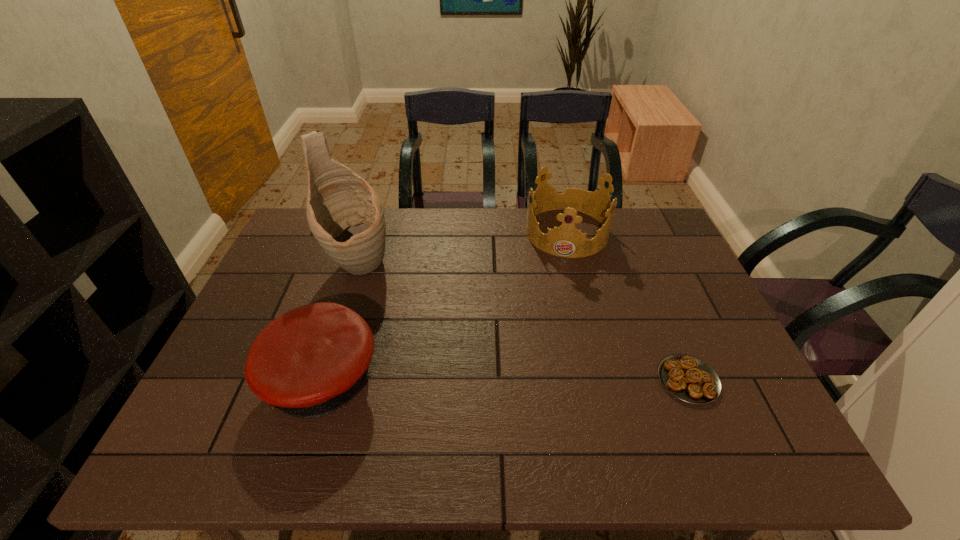
Identify the location of the second shortest object. This screenshot has width=960, height=540. (309, 362).

You are a GUI agent. You are given a task and a screenshot of the screen. Output one action in this format:
    pyautogui.click(x=<x>, y=<y>)
    Task: Click on the shortest object
    Image resolution: width=960 pixels, height=540 pixels.
    Given the screenshot: What is the action you would take?
    pyautogui.click(x=688, y=378)

What are the coordinates of `pitcher` in the screenshot? It's located at (346, 216).

I want to click on tiara, so click(567, 241).

The image size is (960, 540). I want to click on free space located 0.130m at the front of the cap where the visor is located, so click(x=209, y=380).

The image size is (960, 540). I want to click on free space located at the front of the cap where the visor is located, so click(x=235, y=380).

What are the coordinates of `vacant space located at the front of the cap where the visor is located` in the screenshot? It's located at (218, 380).

Locate an element on the screen. This screenshot has width=960, height=540. free spot located on the left of the pastry is located at coordinates (620, 380).

Locate an element on the screen. The height and width of the screenshot is (540, 960). free space located 0.170m at the spout of the pitcher is located at coordinates (409, 316).

At what (x,y) coordinates should I click in order to perform the action: click on blank space located 0.220m at the spout of the pitcher. Please return your answer as a coordinate pair (x, y). The height and width of the screenshot is (540, 960). Looking at the image, I should click on point(420,327).